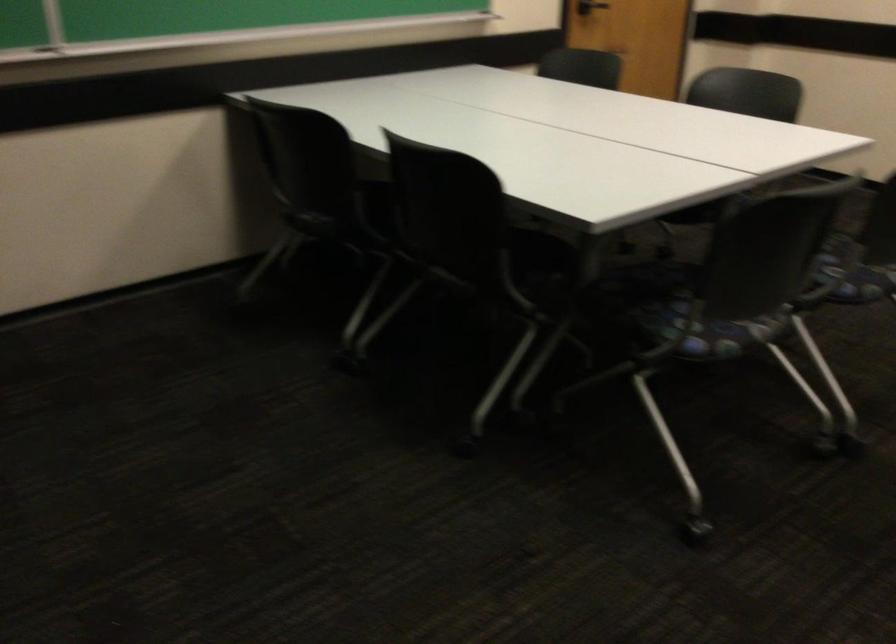
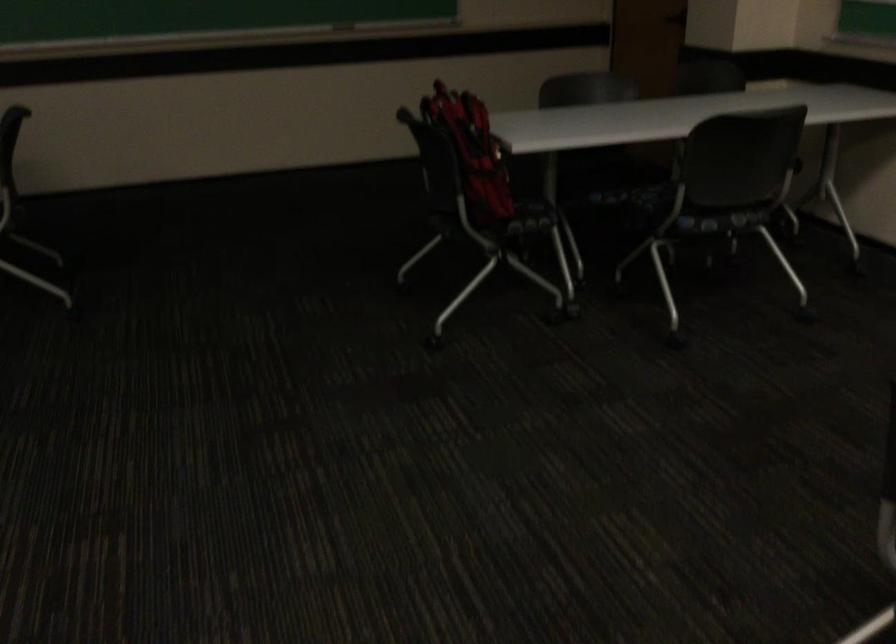
Where in the second image is the point corresponding to (468,573) from the first image?

(713, 547)